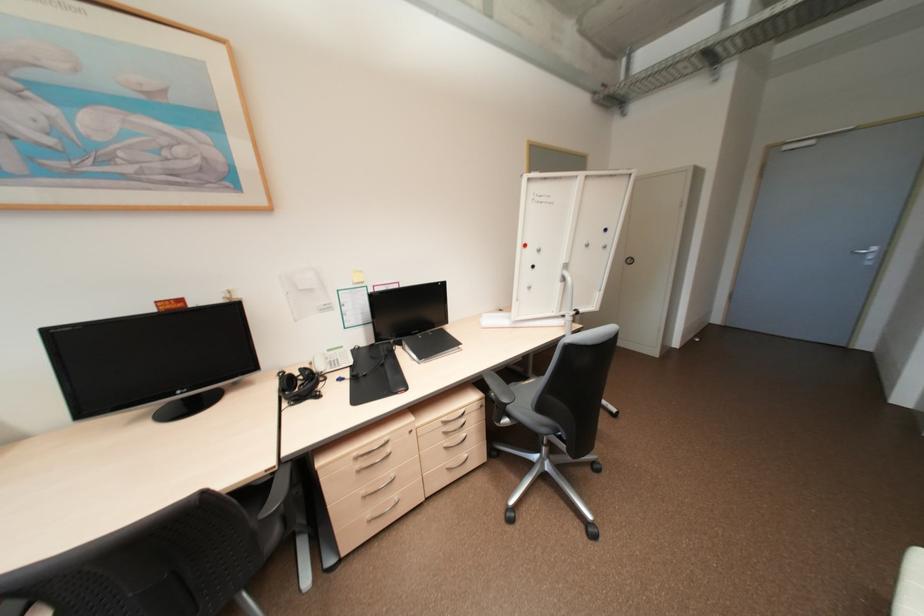
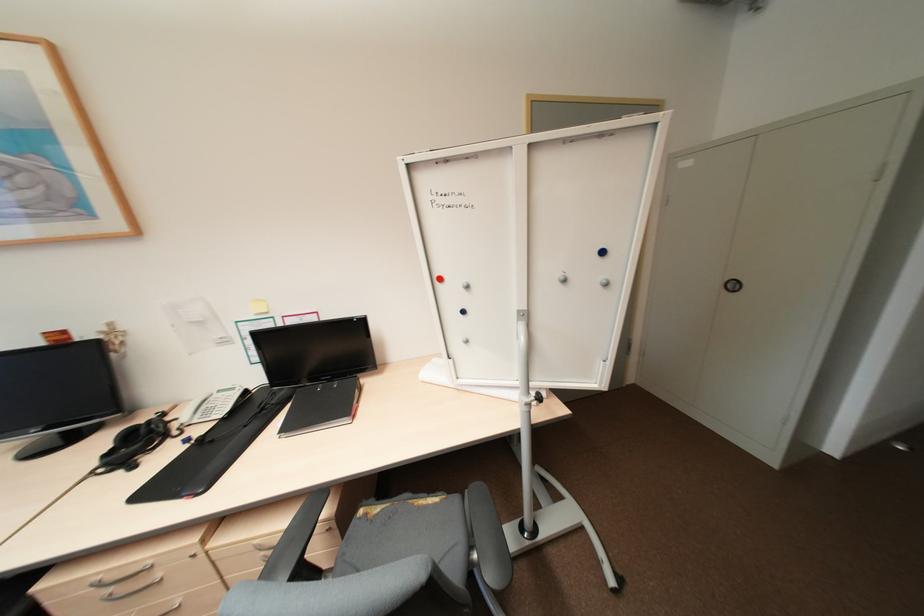
Locate, in the second image, the point that corresponds to (x=576, y=318) in the first image.

(531, 408)